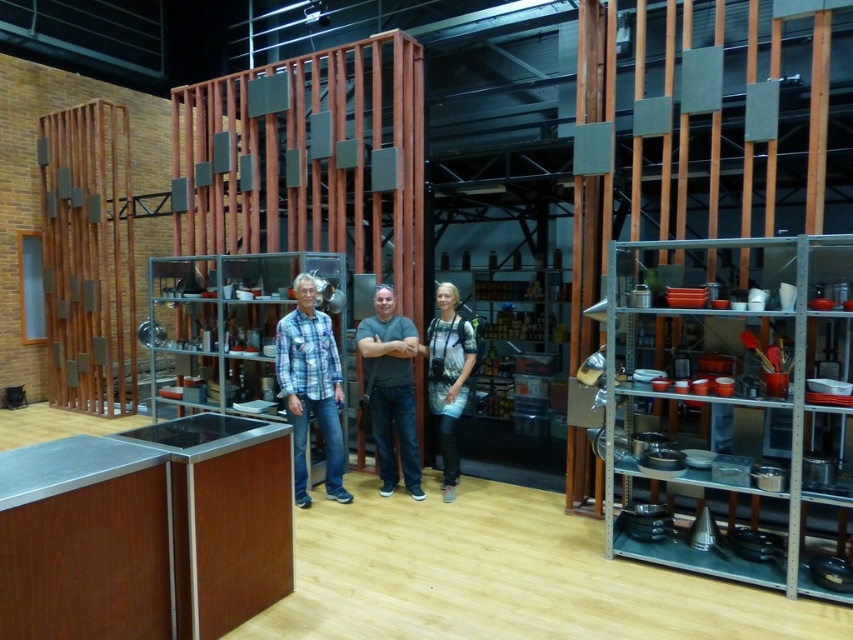
Question: Does plaid cotton shirt at center lie behind blue plaid shirt at center?

Choices:
 (A) yes
 (B) no

Answer: (A)

Question: Among these objects, which one is nearest to the camera?

Choices:
 (A) plaid cotton shirt at center
 (B) denim jacket at center
 (C) blue plaid shirt at center

Answer: (C)

Question: Does blue plaid shirt at center have a smaller size compared to denim jacket at center?

Choices:
 (A) no
 (B) yes

Answer: (A)

Question: Which point is farther from the camera taking this photo?

Choices:
 (A) (450, 396)
 (B) (395, 333)
 (C) (334, 492)

Answer: (B)

Question: Which object is farther from the camera taking this photo?

Choices:
 (A) denim jacket at center
 (B) plaid cotton shirt at center
 (C) gray matte shirt at center

Answer: (B)

Question: Can you confirm if gray matte shirt at center is wider than denim jacket at center?

Choices:
 (A) yes
 (B) no

Answer: (A)